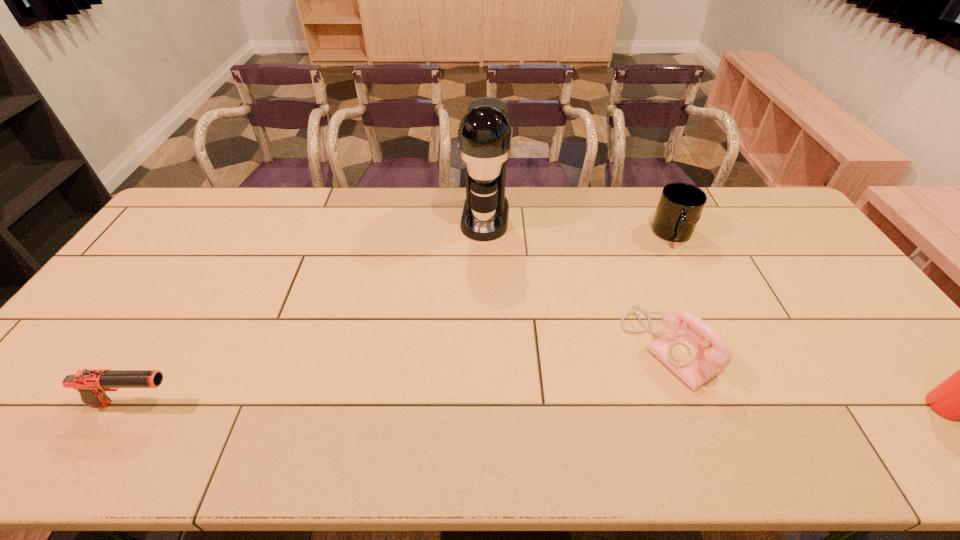
The image size is (960, 540). I want to click on vacant area that lies between the mug and the third nearest object, so click(672, 291).

Choose which object is the third nearest neighbor to the mug. Please provide its 2D coordinates. Your answer should be formatted as a tuple, i.e. [(x, y)], where the tuple contains the x and y coordinates of a point satisfying the conditions above.

[(959, 397)]

Find the location of `the second closest object to the tallest object`. the second closest object to the tallest object is located at coordinates (680, 206).

The image size is (960, 540). I want to click on free space that satisfies the following two spatial constraints: 1. on the back side of the mug; 2. on the right side of the telephone, so click(629, 234).

Identify the location of free spot that satisfies the following two spatial constraints: 1. on the front side of the coffee maker; 2. on the left side of the mug. (486, 234).